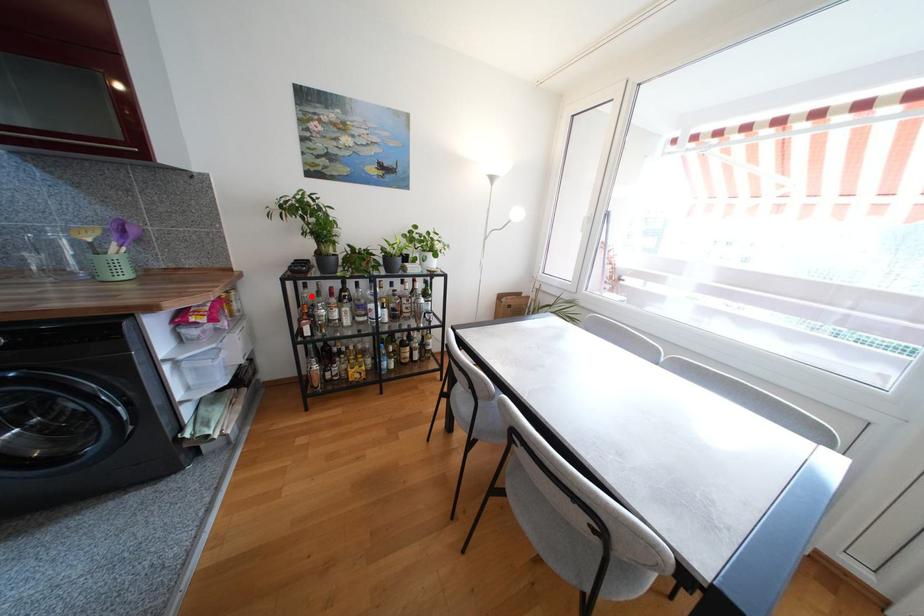
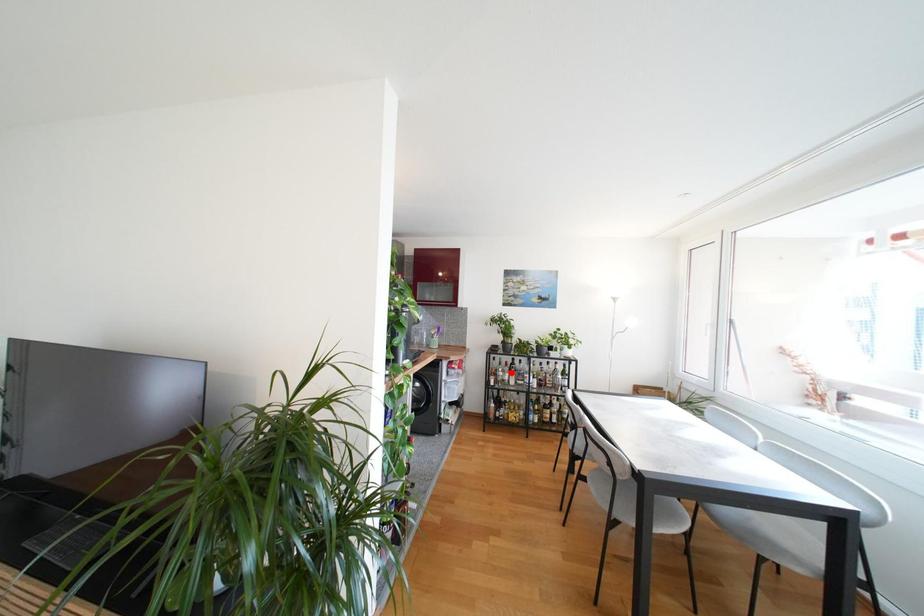
I am providing you with two images of the same scene from different viewpoints. A red point is marked on the first image and another point is marked on the second image. Do the highlighted points in image1 and image2 indicate the same real-world spot?

No